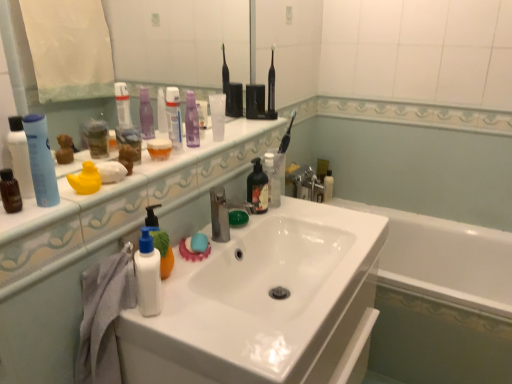
Find the location of a particular element. vacant area that is situated to the right of purple matte lotion at center, marked as the 2th toiletry in a back-to-front arrangement is located at coordinates [234, 136].